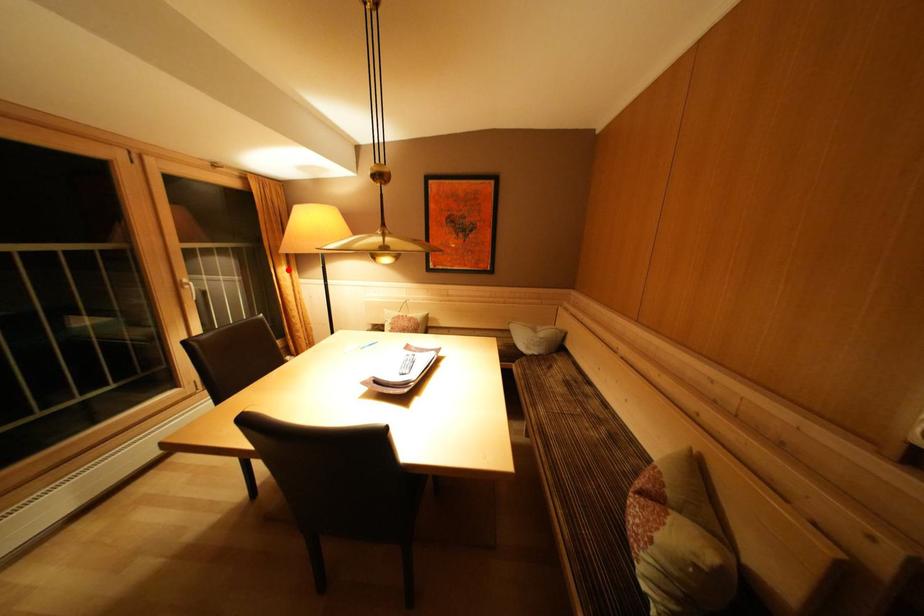
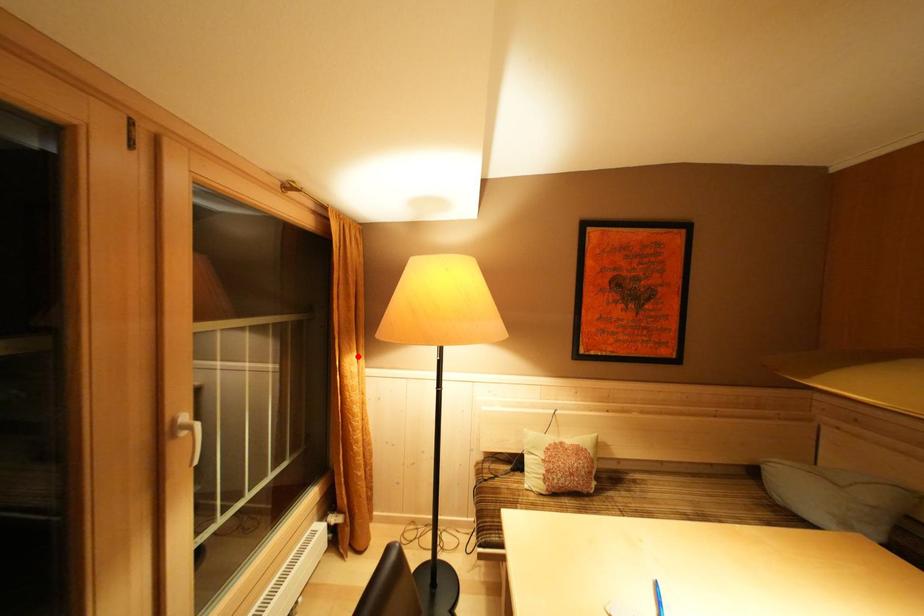
I am providing you with two images of the same scene from different viewpoints. A red point is marked on the first image and another point is marked on the second image. Is the marked point in image1 the same physical position as the marked point in image2?

Yes